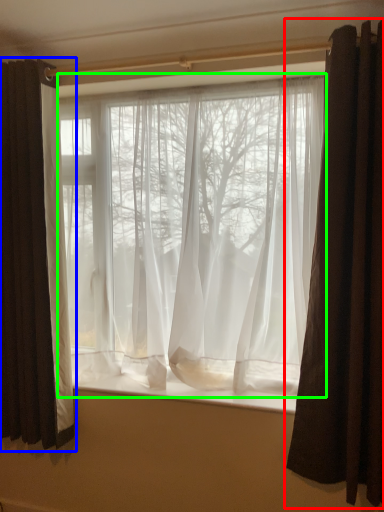
Question: Which object is positioned closest to curtain (highlighted by a red box)? Select from curtain (highlighted by a blue box) and curtain (highlighted by a green box).

Choices:
 (A) curtain
 (B) curtain

Answer: (B)